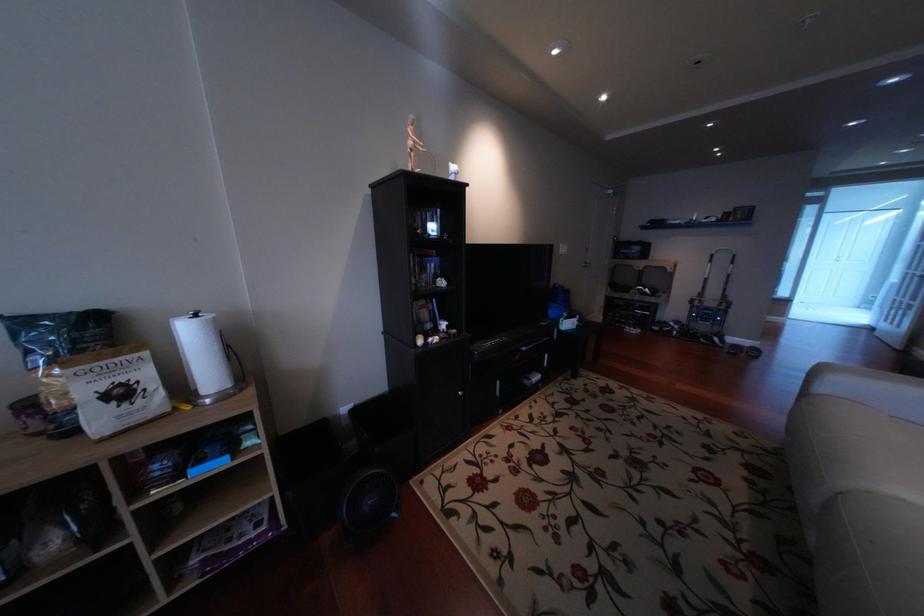
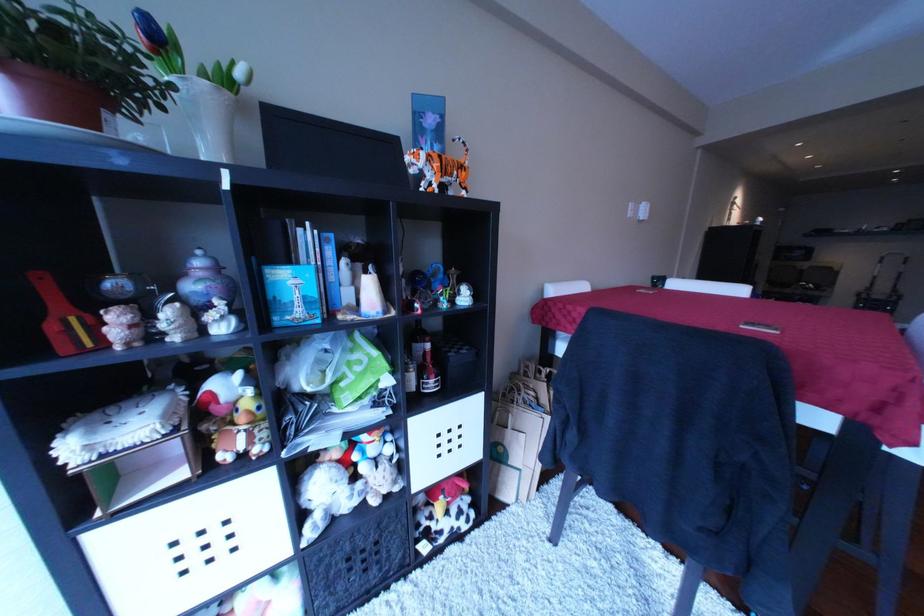
Which direction would the cameraman need to move to produce the second image?

The cameraman moved toward left, backward.